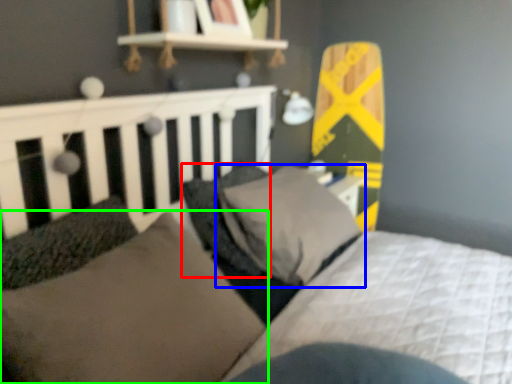
Question: Based on their relative distances, which object is farther from pillow (highlighted by a red box)? Choose from pillow (highlighted by a blue box) and pillow (highlighted by a green box).

Choices:
 (A) pillow
 (B) pillow

Answer: (B)